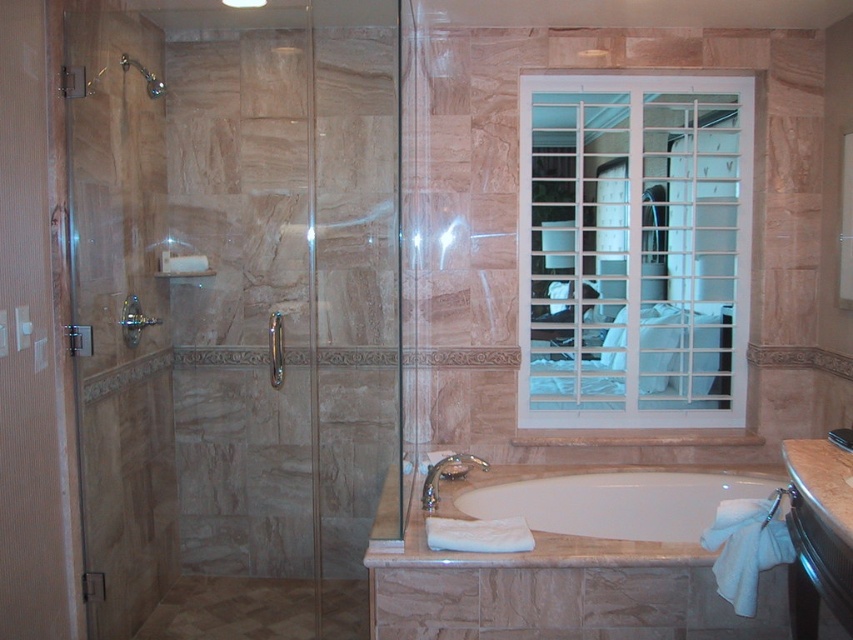
In the bathroom scene, there are two glass doors on the left side. The first is labeled as the transparent glass shower door at left, and the second is the clear glass door at left. Which of these two doors is taller?

The transparent glass shower door at left is taller than the clear glass door at left.

You are standing in the bathroom and want to locate the transparent glass shower door at left. According to the scene description, where would you find it?

The transparent glass shower door at left is located at point [233,316] in the scene.